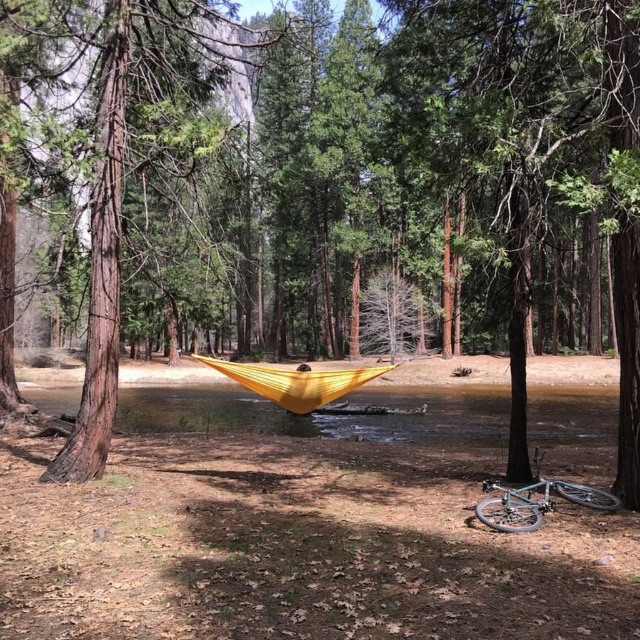
You are planning to hang a birdhouse on the brown rough tree trunk at left and the teal metallic bicycle at lower right. Which object would allow the birdhouse to be placed higher up?

The brown rough tree trunk at left is taller than the teal metallic bicycle at lower right, so the birdhouse can be placed higher up on the brown rough tree trunk at left.

You are planning to hang a new hammock between the two trees in the scene. The hammock requires a distance of 6 meters between the trees to be properly installed. Can the brown rough tree trunk at left and the other tree support the hammock?

The distance between the brown rough tree trunk at left and the other tree is 6.10 meters, which is slightly more than the required 6 meters. Therefore, the hammock can be properly installed between them.

You are standing at the campsite and want to walk from the brown rough tree trunk at left to the teal metallic bicycle at lower right. Which direction should you move relative to the tree trunk?

You should move towards the lower right direction away from the brown rough tree trunk at left to reach the teal metallic bicycle at lower right, as the tree trunk is closer to you than the bicycle.